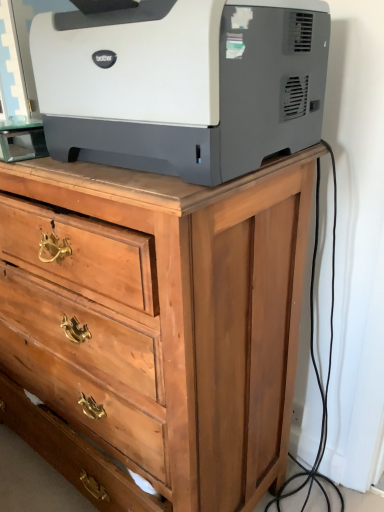
I want to click on wooden chest of drawers at upper center, so tap(156, 324).

This screenshot has height=512, width=384. What do you see at coordinates (156, 324) in the screenshot? I see `wooden chest of drawers at upper center` at bounding box center [156, 324].

Find the location of a particular element. This screenshot has height=512, width=384. white matte printer at upper center is located at coordinates (183, 84).

Describe the element at coordinates (183, 84) in the screenshot. This screenshot has width=384, height=512. I see `white matte printer at upper center` at that location.

What is the approximate width of white matte printer at upper center?

white matte printer at upper center is 17.33 inches wide.

Find the location of a particular element. The width and height of the screenshot is (384, 512). wooden chest of drawers at upper center is located at coordinates (156, 324).

Considering the relative positions of wooden chest of drawers at upper center and white matte printer at upper center in the image provided, is wooden chest of drawers at upper center to the left of white matte printer at upper center from the viewer's perspective?

Yes, wooden chest of drawers at upper center is to the left of white matte printer at upper center.

Between wooden chest of drawers at upper center and white matte printer at upper center, which one is positioned in front?

white matte printer at upper center is more forward.

Is point (23, 271) farther from camera compared to point (277, 28)?

Yes, it is behind point (277, 28).

From the image's perspective, is wooden chest of drawers at upper center positioned above or below white matte printer at upper center?

wooden chest of drawers at upper center is situated lower than white matte printer at upper center in the image.

Consider the image. From a real-world perspective, is wooden chest of drawers at upper center on top of white matte printer at upper center?

No, from a real-world perspective, wooden chest of drawers at upper center is not on top of white matte printer at upper center.

Considering the relative sizes of wooden chest of drawers at upper center and white matte printer at upper center in the image provided, is wooden chest of drawers at upper center wider than white matte printer at upper center?

Correct, the width of wooden chest of drawers at upper center exceeds that of white matte printer at upper center.

Does wooden chest of drawers at upper center have a greater height compared to white matte printer at upper center?

Yes.

Looking at this image, is wooden chest of drawers at upper center bigger or smaller than white matte printer at upper center?

In the image, wooden chest of drawers at upper center appears to be larger than white matte printer at upper center.

Is wooden chest of drawers at upper center positioned beyond the bounds of white matte printer at upper center?

Yes.

Is wooden chest of drawers at upper center with white matte printer at upper center?

No.

Could you tell me if wooden chest of drawers at upper center is facing white matte printer at upper center?

No, wooden chest of drawers at upper center is not aimed at white matte printer at upper center.

Can you tell me how much wooden chest of drawers at upper center and white matte printer at upper center differ in facing direction?

There is a 2.12-degree angle between the facing directions of wooden chest of drawers at upper center and white matte printer at upper center.

In the image, there is a white matte printer at upper center. At what (x,y) coordinates should I click in order to perform the action: click on the chest of drawers below it (from a real-world perspective). Please return your answer as a coordinate pair (x, y). Image resolution: width=384 pixels, height=512 pixels. Looking at the image, I should click on (156, 324).

Between white matte printer at upper center and wooden chest of drawers at upper center, which one appears on the right side from the viewer's perspective?

white matte printer at upper center.

In the scene shown: Is white matte printer at upper center positioned behind wooden chest of drawers at upper center?

No, it is in front of wooden chest of drawers at upper center.

Is point (237, 67) behind point (202, 477)?

No, it is not.

From the image's perspective, which one is positioned lower, white matte printer at upper center or wooden chest of drawers at upper center?

wooden chest of drawers at upper center appears lower in the image.

From a real-world perspective, is white matte printer at upper center located beneath wooden chest of drawers at upper center?

No, from a real-world perspective, white matte printer at upper center is not below wooden chest of drawers at upper center.

Considering the sizes of objects white matte printer at upper center and wooden chest of drawers at upper center in the image provided, who is thinner, white matte printer at upper center or wooden chest of drawers at upper center?

white matte printer at upper center.

Who is shorter, white matte printer at upper center or wooden chest of drawers at upper center?

Standing shorter between the two is white matte printer at upper center.

Is white matte printer at upper center smaller than wooden chest of drawers at upper center?

Indeed, white matte printer at upper center has a smaller size compared to wooden chest of drawers at upper center.

Is white matte printer at upper center surrounding wooden chest of drawers at upper center?

No, wooden chest of drawers at upper center is located outside of white matte printer at upper center.

In the scene shown: Are white matte printer at upper center and wooden chest of drawers at upper center located far from each other?

No, there isn't a large distance between white matte printer at upper center and wooden chest of drawers at upper center.

Is white matte printer at upper center oriented away from wooden chest of drawers at upper center?

No, white matte printer at upper center is not facing the opposite direction of wooden chest of drawers at upper center.

This screenshot has height=512, width=384. What are the coordinates of `chest of drawers behind the white matte printer at upper center` in the screenshot? It's located at (156, 324).

The image size is (384, 512). Find the location of `the chest of drawers behind the white matte printer at upper center`. the chest of drawers behind the white matte printer at upper center is located at coordinates (156, 324).

At what (x,y) coordinates should I click in order to perform the action: click on the chest of drawers directly beneath the white matte printer at upper center (from a real-world perspective). Please return your answer as a coordinate pair (x, y). The image size is (384, 512). Looking at the image, I should click on (156, 324).